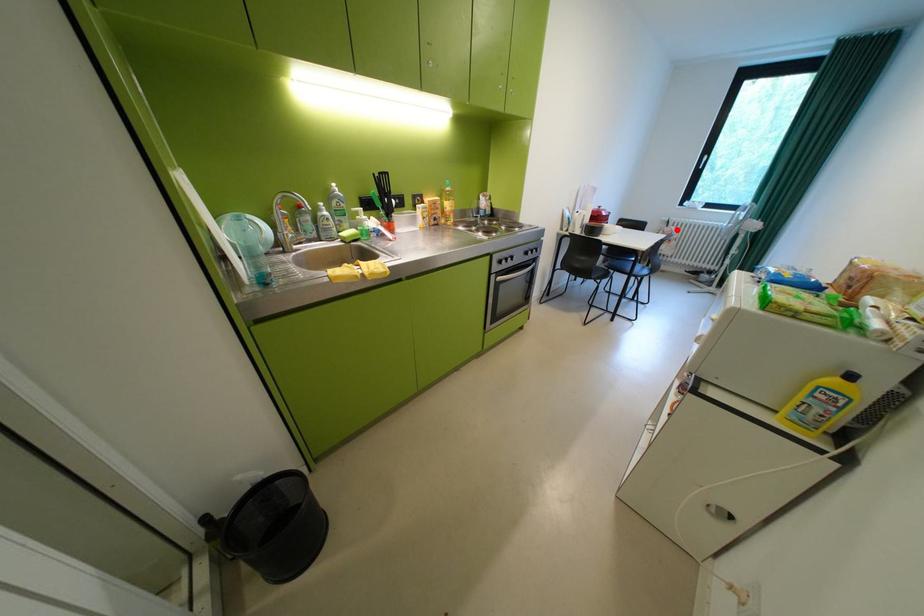
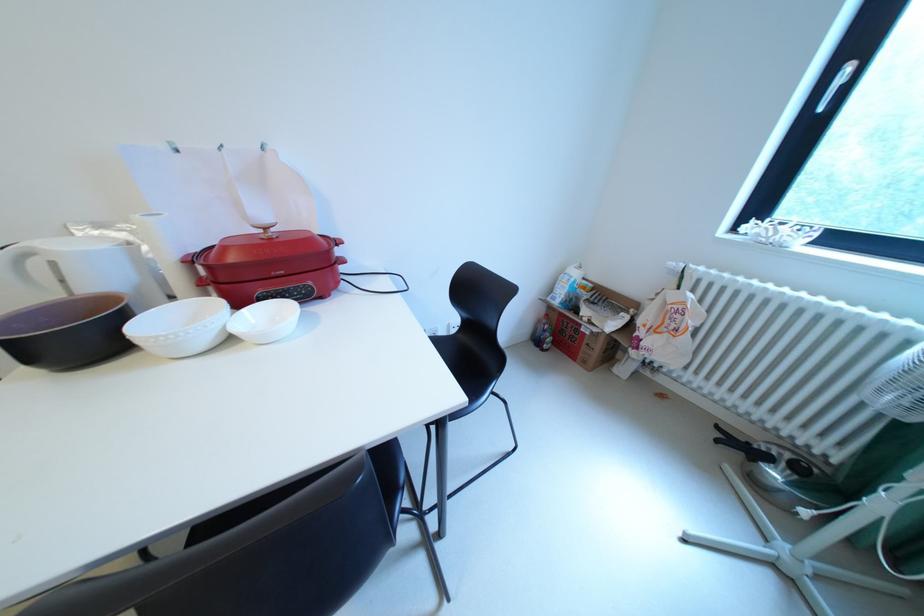
Question: A red point is marked in image1. In image2, is the corresponding 3D point closer to the camera or farther? Reply with the corresponding letter.

Choices:
 (A) The corresponding 3D point is closer.
 (B) The corresponding 3D point is farther.

Answer: (A)